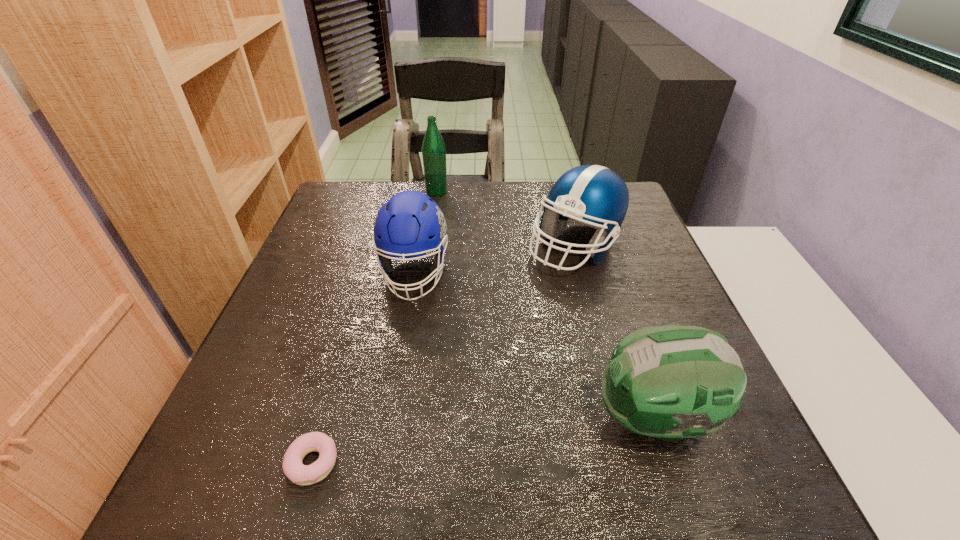
Select which football helmet is the second closest to the shortest object. Please provide its 2D coordinates. Your answer should be formatted as a tuple, i.e. [(x, y)], where the tuple contains the x and y coordinates of a point satisfying the conditions above.

[(671, 382)]

Find the location of `free space that satisfies the following two spatial constraints: 1. on the back side of the doughnut; 2. on the left side of the farthest object`. free space that satisfies the following two spatial constraints: 1. on the back side of the doughnut; 2. on the left side of the farthest object is located at coordinates (393, 191).